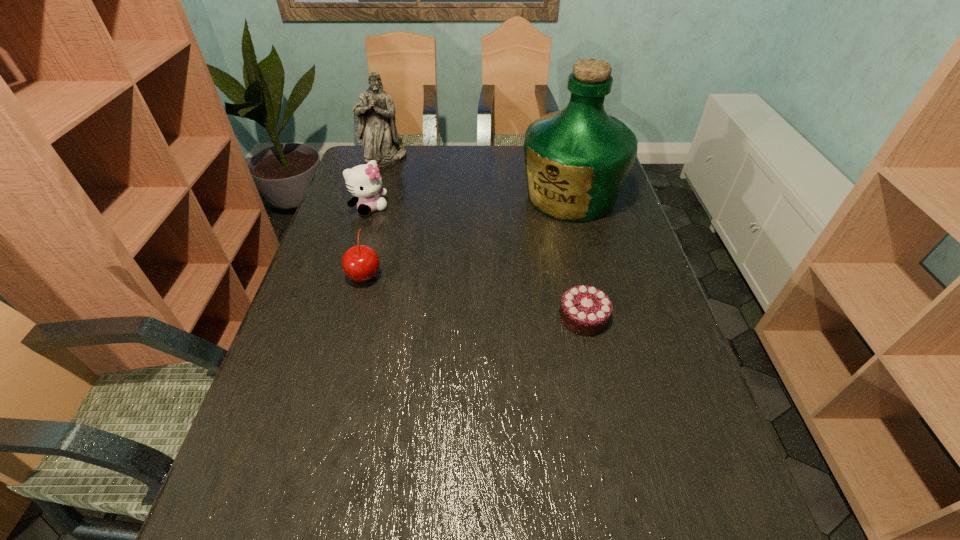
Locate an element on the screen. Image resolution: width=960 pixels, height=540 pixels. blank area located 0.250m on the front-facing side of the farthest object is located at coordinates (416, 204).

Identify the location of vacant region located on the front-facing side of the farthest object. (405, 188).

Where is `vacant area situated 0.070m on the front-facing side of the farthest object`? The width and height of the screenshot is (960, 540). vacant area situated 0.070m on the front-facing side of the farthest object is located at coordinates (398, 176).

What are the coordinates of `free region located 0.300m on the label side of the tallest object` in the screenshot? It's located at (479, 273).

Identify the location of vacant space located 0.350m on the label side of the tallest object. (467, 284).

Find the location of a particular element. vacant area situated 0.100m on the label side of the tallest object is located at coordinates (522, 237).

Where is `vacant area situated on the front-facing side of the third shortest object`? The height and width of the screenshot is (540, 960). vacant area situated on the front-facing side of the third shortest object is located at coordinates (444, 285).

Identify the location of vacant area situated 0.340m on the front-facing side of the third shortest object. (437, 279).

I want to click on vacant space situated 0.110m on the front-facing side of the third shortest object, so click(x=396, y=235).

Where is `figurine at the far edge`? This screenshot has width=960, height=540. figurine at the far edge is located at coordinates (376, 112).